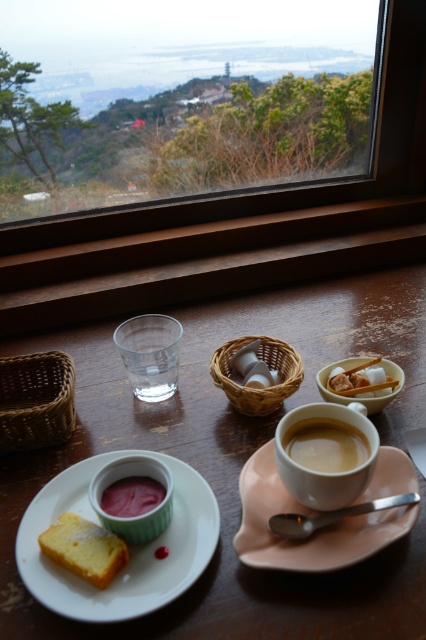
In the scene shown: You are sitting at the wooden table and want to reach both the point at coordinates point (141,317) and point (138,497). Which point do you need to reach first if you are moving your hand from your lap towards the table surface?

You need to reach point (141,317) first because it is closer to you than point (138,497), which is further away.

You are setting up a table for a breakfast buffet and need to arrange items according to size. The transparent glass at center and pink glossy jam at lower left must be placed in order from largest to smallest. Which should come first?

The transparent glass at center should come first since it is larger in size than the pink glossy jam at lower left.